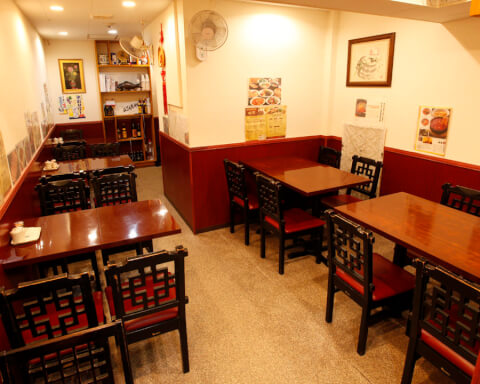
Where is `table`? Image resolution: width=480 pixels, height=384 pixels. table is located at coordinates 453,241.